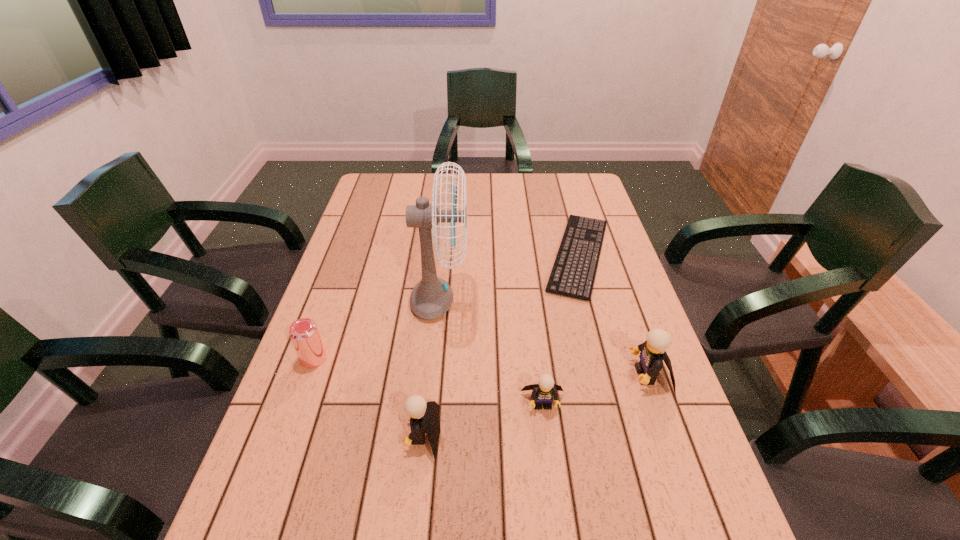
In order to click on free space in the image that satisfies the following two spatial constraints: 1. on the front-facing side of the fifth shortest object; 2. on the front-facing side of the second shortest object in this screenshot , I will do `click(659, 403)`.

Locate an element on the screen. Image resolution: width=960 pixels, height=540 pixels. free space that satisfies the following two spatial constraints: 1. on the front side of the computer keyboard; 2. on the front-facing side of the second shortest Lego is located at coordinates (627, 434).